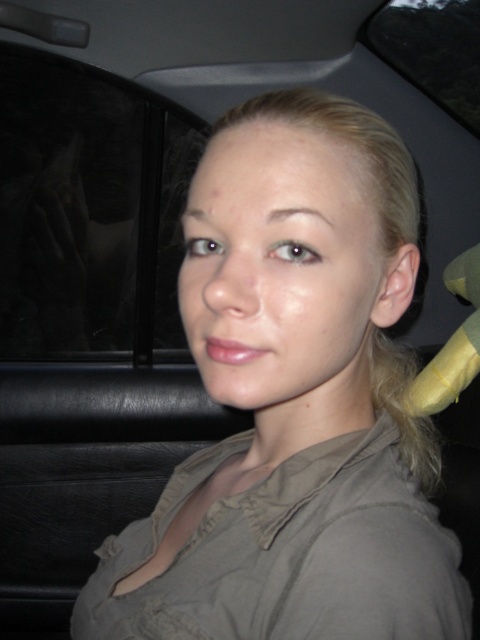
Question: Does transparent glass at left appear on the right side of transparent glass window at upper center?

Choices:
 (A) no
 (B) yes

Answer: (A)

Question: Is transparent glass at left wider than transparent glass window at upper center?

Choices:
 (A) yes
 (B) no

Answer: (A)

Question: Is transparent glass at left thinner than transparent glass window at upper center?

Choices:
 (A) no
 (B) yes

Answer: (A)

Question: Which point is closer to the camera?

Choices:
 (A) (48, 320)
 (B) (402, 12)

Answer: (B)

Question: Which of the following is the closest to the observer?

Choices:
 (A) (67, 179)
 (B) (448, 74)

Answer: (A)